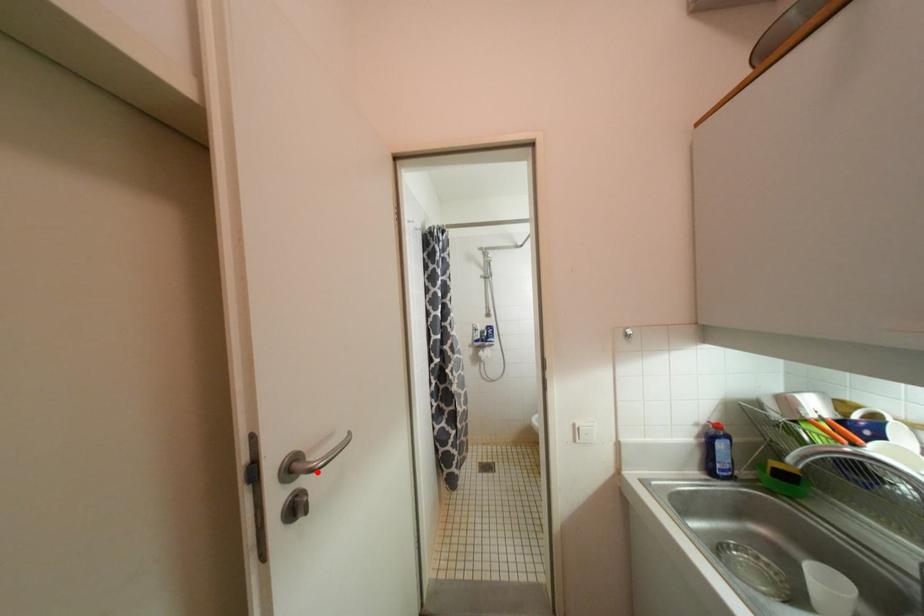
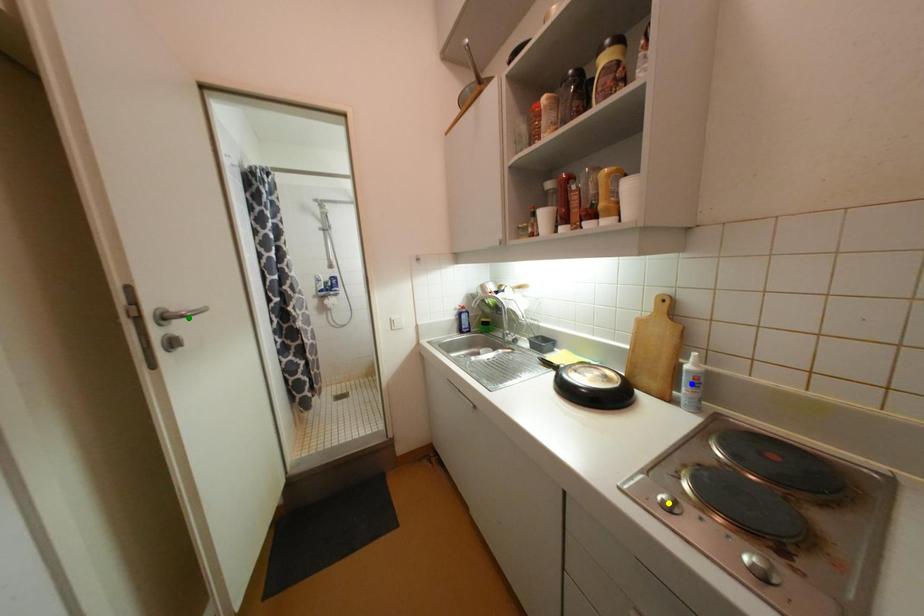
Question: I am providing you with two images of the same scene from different viewpoints. A red point is marked on the first image. You are given multiple points on the second image. Which mark in image 2 goes with the point in image 1?

Choices:
 (A) yellow point
 (B) green point
 (C) blue point

Answer: (B)